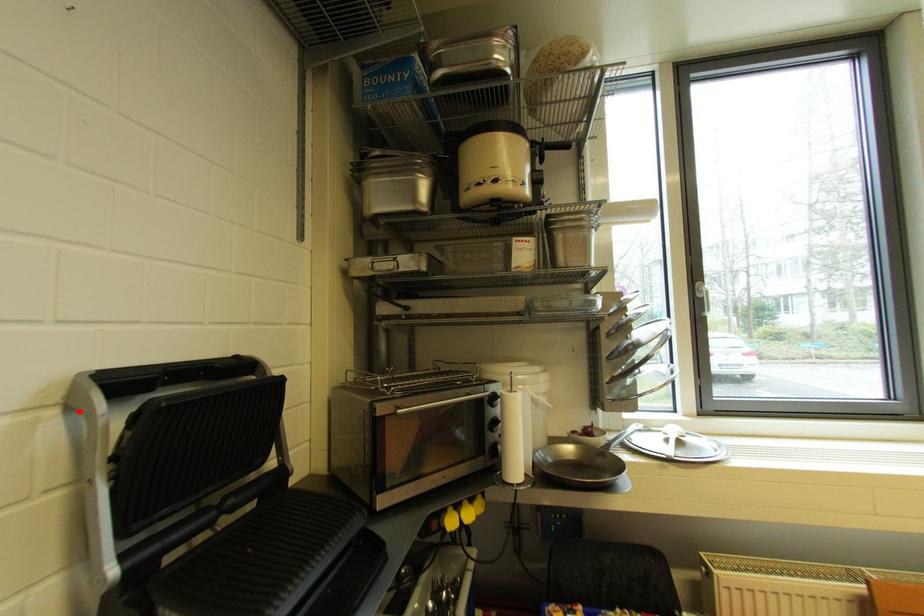
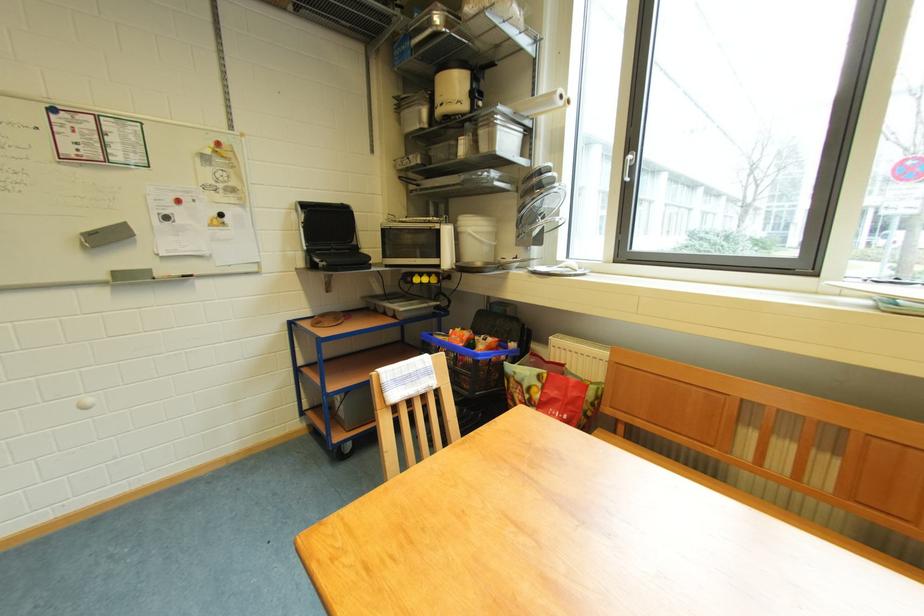
Where in the second image is the point corresponding to the highlighted location from the first image?

(305, 214)